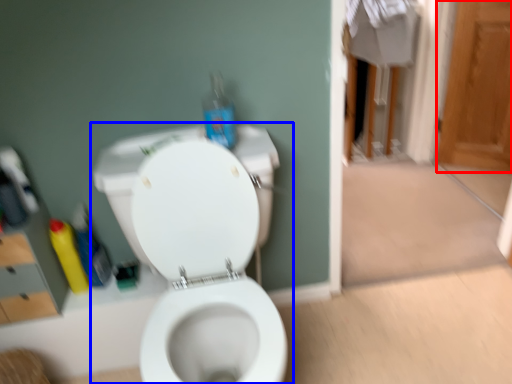
Question: Which object is closer to the camera taking this photo, screen door (highlighted by a red box) or toilet (highlighted by a blue box)?

Choices:
 (A) screen door
 (B) toilet

Answer: (B)